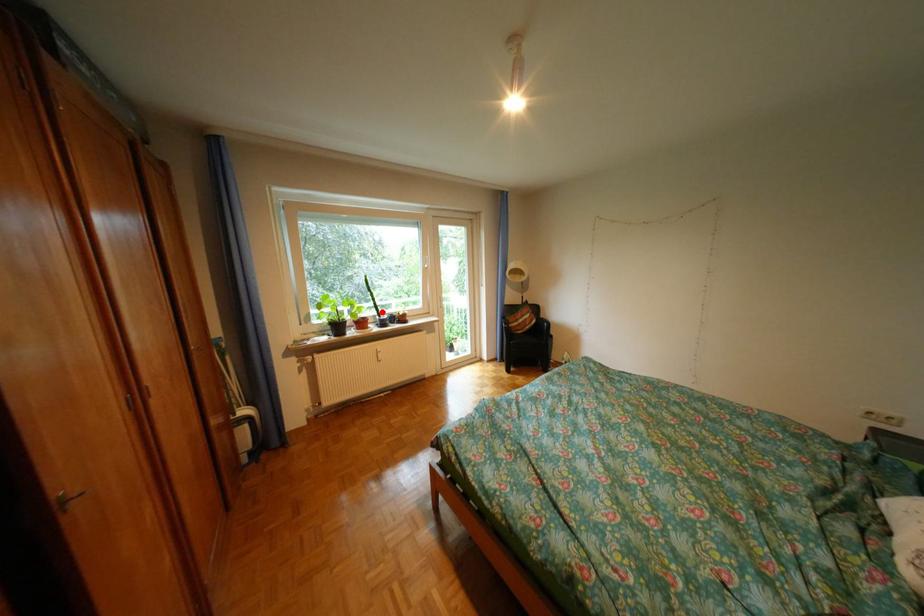
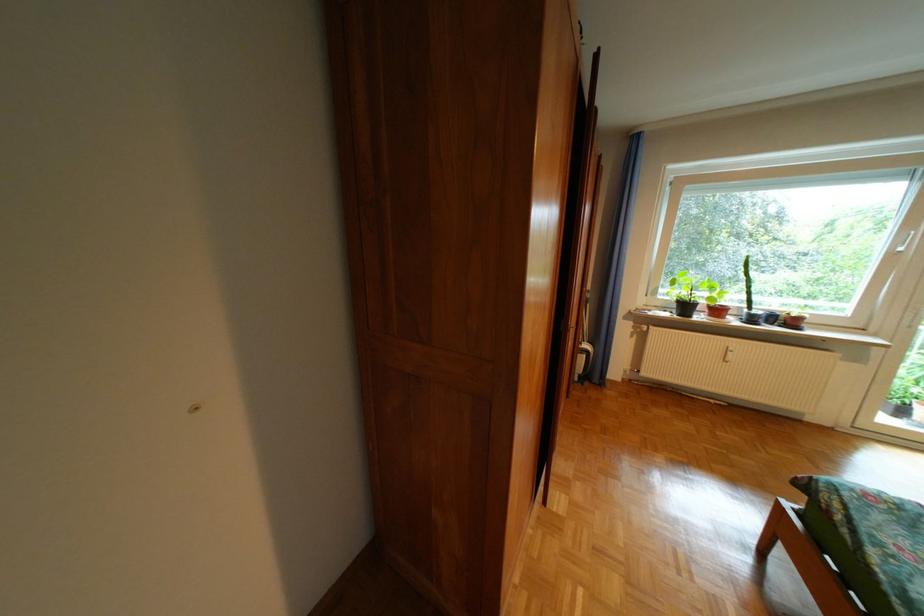
In the second image, find the point that corresponds to the highlighted location in the first image.

(747, 300)